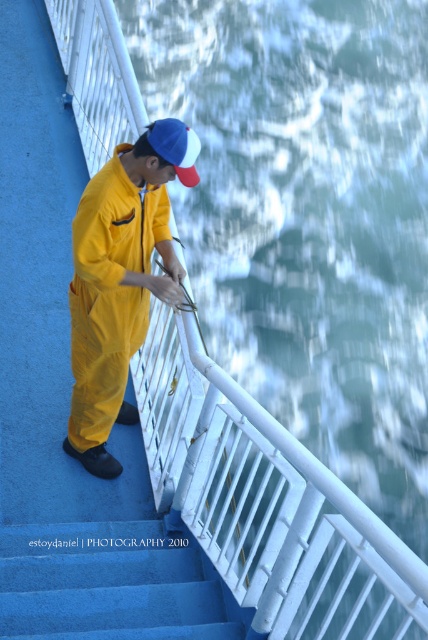
You are on the staircase and want to move from the point at coordinates point (204,593) to the point at coordinates point (196,177). Which direction should you move in relative to the staircase?

Since point (204,593) is behind point (196,177), you should move forward towards the point at (196,177) along the staircase.